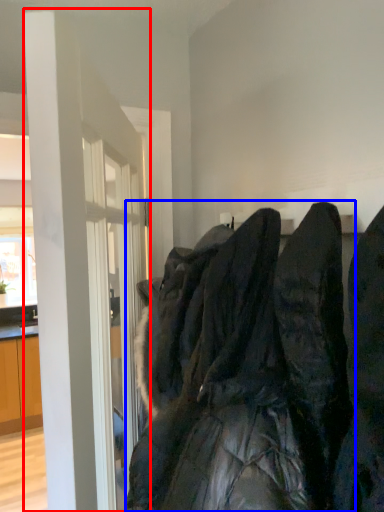
Question: Which of the following is the closest to the observer, door (highlighted by a red box) or laundry (highlighted by a blue box)?

Choices:
 (A) door
 (B) laundry

Answer: (B)